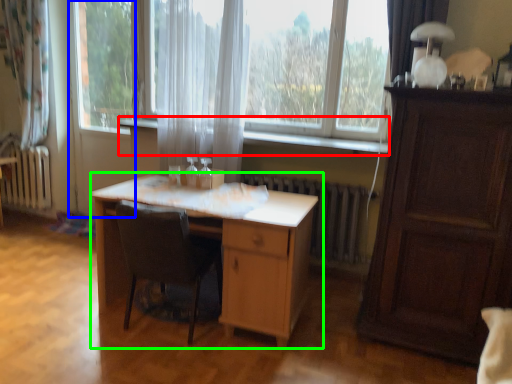
Question: Estimate the real-world distances between objects in this image. Which object is farther from window sill (highlighted by a red box), screen door (highlighted by a blue box) or table (highlighted by a green box)?

Choices:
 (A) screen door
 (B) table

Answer: (A)